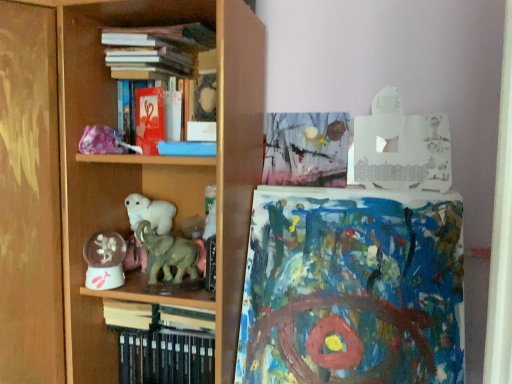
Question: Can you confirm if wooden shelf at center is bigger than hardcover books at upper center, the 4th book ordered from the bottom?

Choices:
 (A) no
 (B) yes

Answer: (B)

Question: Would you say wooden shelf at center contains hardcover books at upper center, the 4th book ordered from the bottom?

Choices:
 (A) no
 (B) yes

Answer: (B)

Question: Would you say wooden shelf at center is outside hardcover books at upper center, the 4th book ordered from the bottom?

Choices:
 (A) no
 (B) yes

Answer: (B)

Question: Is wooden shelf at center far from hardcover books at upper center, acting as the 1th book starting from the top?

Choices:
 (A) no
 (B) yes

Answer: (A)

Question: Does wooden shelf at center turn towards hardcover books at upper center, the 4th book ordered from the bottom?

Choices:
 (A) yes
 (B) no

Answer: (B)

Question: Is wooden shelf at center to the right of hardcover books at upper center, acting as the 1th book starting from the top, from the viewer's perspective?

Choices:
 (A) yes
 (B) no

Answer: (A)

Question: Is hardcover books at lower left, the 1th book positioned from the bottom, further to the viewer compared to blue textured paper at center?

Choices:
 (A) no
 (B) yes

Answer: (B)

Question: From the image's perspective, is hardcover books at lower left, the 1th book positioned from the bottom, located beneath blue textured paper at center?

Choices:
 (A) yes
 (B) no

Answer: (A)

Question: Is hardcover books at lower left, the 1th book positioned from the bottom, shorter than blue textured paper at center?

Choices:
 (A) yes
 (B) no

Answer: (A)

Question: Considering the relative sizes of hardcover books at lower left, arranged as the 4th book when viewed from the top, and blue textured paper at center in the image provided, is hardcover books at lower left, arranged as the 4th book when viewed from the top, taller than blue textured paper at center?

Choices:
 (A) yes
 (B) no

Answer: (B)

Question: Is hardcover books at lower left, arranged as the 4th book when viewed from the top, far away from blue textured paper at center?

Choices:
 (A) yes
 (B) no

Answer: (B)

Question: Is hardcover books at lower left, the 1th book positioned from the bottom, oriented towards blue textured paper at center?

Choices:
 (A) no
 (B) yes

Answer: (A)

Question: From the image's perspective, would you say green matte elephant at center is shown under hardcover books at lower left, the 1th book positioned from the bottom?

Choices:
 (A) no
 (B) yes

Answer: (A)